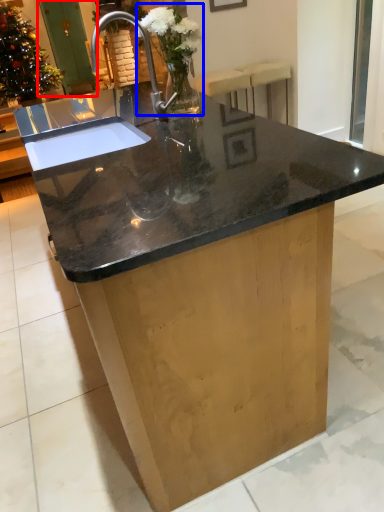
Question: Which of the following is the closest to the observer, screen door (highlighted by a red box) or floral arrangement (highlighted by a blue box)?

Choices:
 (A) screen door
 (B) floral arrangement

Answer: (B)